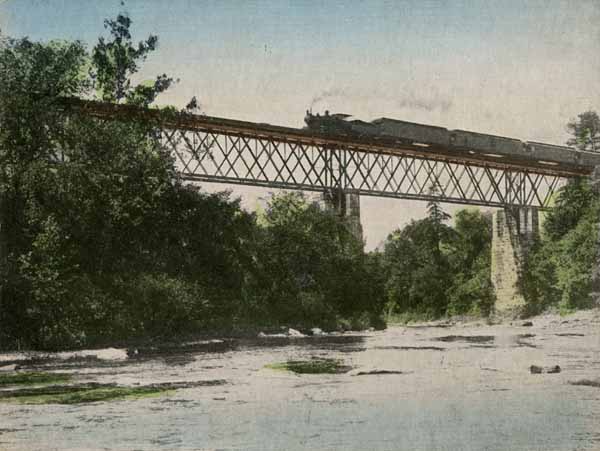
The height and width of the screenshot is (451, 600). Identify the location of brick pillar. (506, 272).